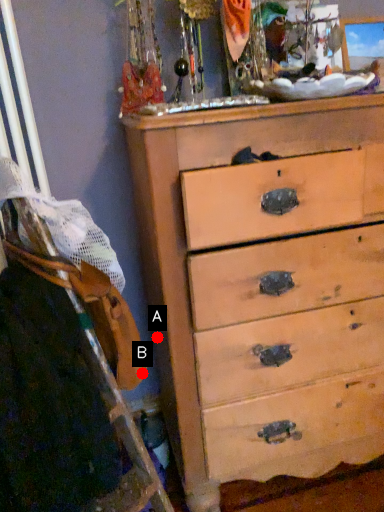
Question: Two points are circled on the image, labeled by A and B beside each circle. Which of the following is the closest to the observer?

Choices:
 (A) A is closer
 (B) B is closer

Answer: (B)